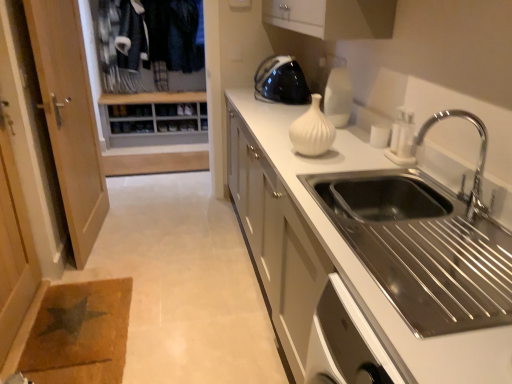
The height and width of the screenshot is (384, 512). Find the location of `vacant area in front of white matte vase at center`. vacant area in front of white matte vase at center is located at coordinates (316, 167).